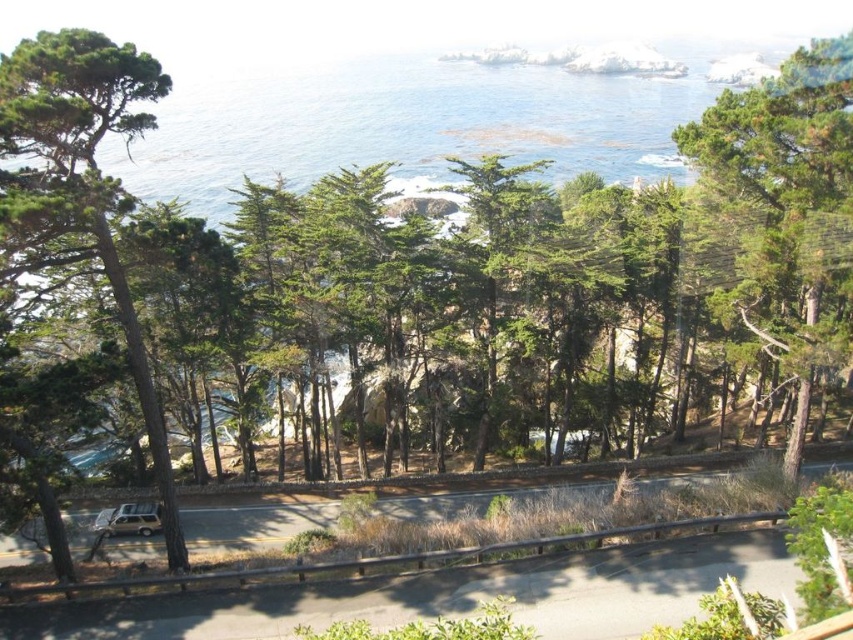
You are a photographer standing at the top of a cliff overlooking the coastal road. You want to take a photo of the gold metallic car at lower left without the green textured tree at left blocking the view. Is this possible based on their positions?

The green textured tree at left is positioned over the gold metallic car at lower left, so it will block the view of the car. You cannot take a photo of the gold metallic car at lower left without the tree blocking it.

You are a hiker planning to walk from the green textured tree at left to the green matte tree at right. Given that your average walking speed is 3 miles per hour, how long would it take you to reach the destination in minutes?

The distance between the green textured tree at left and the green matte tree at right is 68.02 feet. Converting this to miles, 68.02 feet is approximately 0.013 miles. At a walking speed of 3 mph, the time required would be roughly 0.0043 hours, which is about 0.26 minutes or roughly 16 seconds.

You are a hiker standing on the road and looking towards the ocean. You notice two trees in your view, the green matte tree at right and the green textured tree at left. Which tree appears closer to you?

The green textured tree at left appears closer because it is positioned lower in the scene, which suggests it is nearer to the observer compared to the green matte tree at right that is above it.